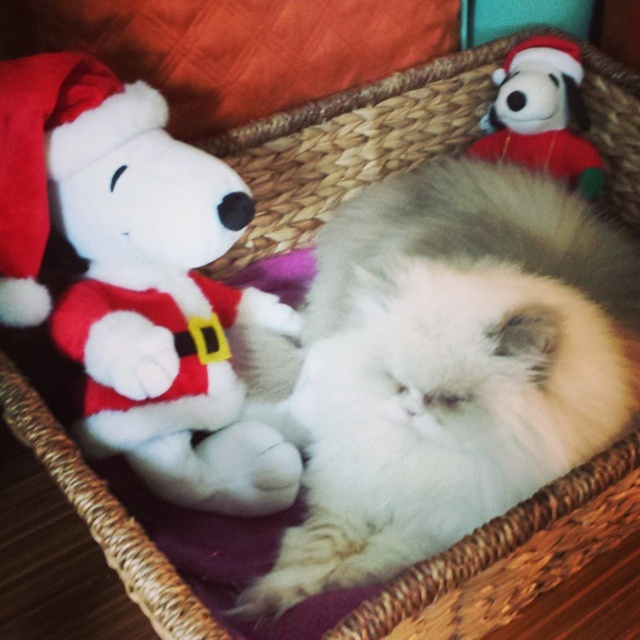
You are organizing a childrens party and need to arrange the white plush toy at left and the white plush santa hat at upper right in the basket. According to the image, which one is located to the left of the other?

The white plush toy at left is positioned on the left side of white plush santa hat at upper right.

You are a photographer standing 40 inches away from the basket. You want to take a closeup photo of the white plush toy at left without moving the basket or the toy. Is the current distance sufficient for a clear closeup?

The distance between the white plush toy at left and the camera is 38.06 inches, which is less than your current distance of 40 inches. To get a clear closeup, you need to move closer to the white plush toy at left so that the distance is at least 38.06 inches. Wait, actually, if the required distance is 38.06 inches and you are already at 40 inches, you might be too far. Maybe you need to move 2 inches closer to reach the required distance for the closeup.